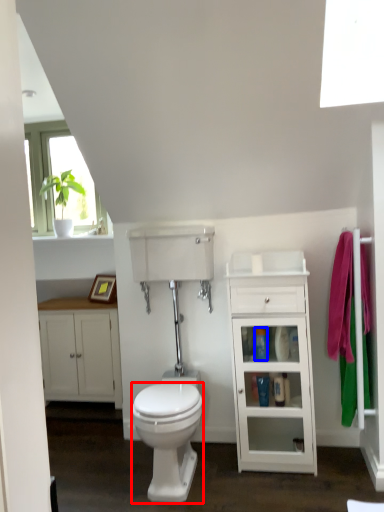
Question: Which of the following is the farthest to the observer, bidet (highlighted by a red box) or toiletry (highlighted by a blue box)?

Choices:
 (A) bidet
 (B) toiletry

Answer: (B)